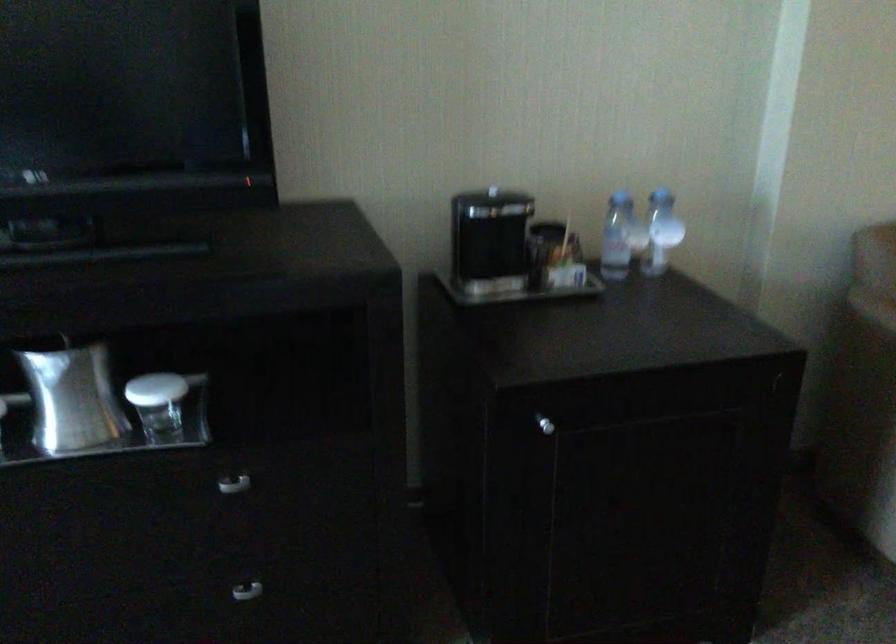
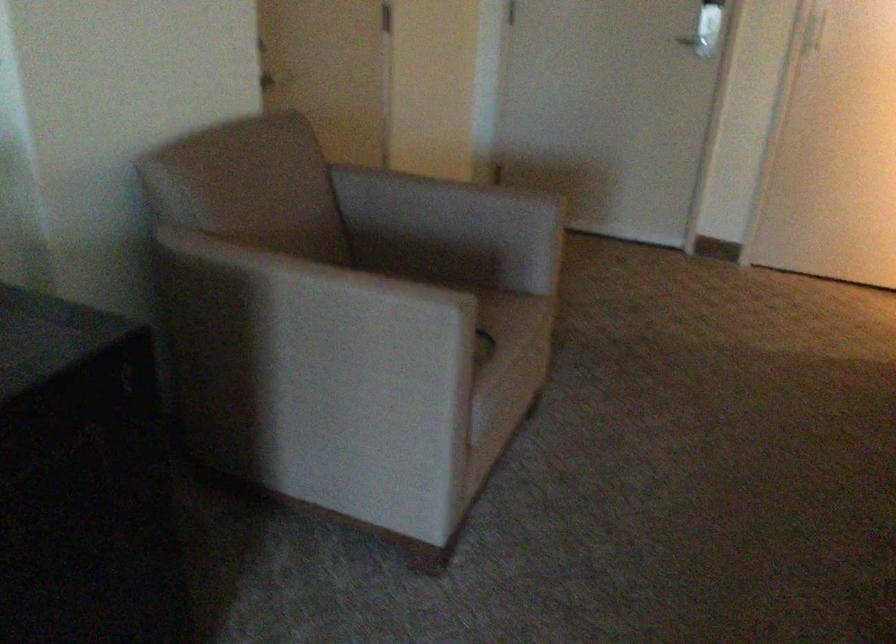
Question: Based on the continuous images, in which direction is the camera rotating? Reply with the corresponding letter.

Choices:
 (A) Left
 (B) Right
 (C) Up
 (D) Down

Answer: (B)